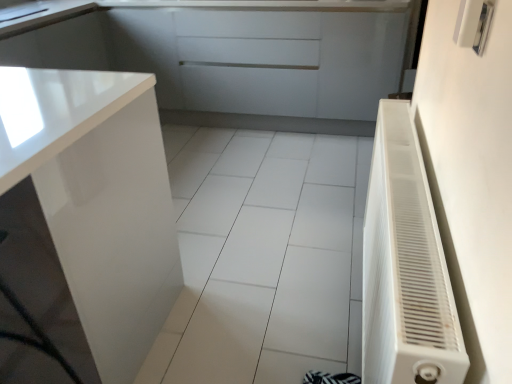
Question: Is metallic silver switch at upper right positioned before glossy white cabinet at upper left, marked as the 2th cabinetry in a bottom-to-top arrangement?

Choices:
 (A) no
 (B) yes

Answer: (B)

Question: From the image's perspective, is metallic silver switch at upper right under glossy white cabinet at upper left, marked as the 2th cabinetry in a bottom-to-top arrangement?

Choices:
 (A) yes
 (B) no

Answer: (A)

Question: From a real-world perspective, is metallic silver switch at upper right located higher than glossy white cabinet at upper left, marked as the 2th cabinetry in a bottom-to-top arrangement?

Choices:
 (A) yes
 (B) no

Answer: (A)

Question: Is metallic silver switch at upper right far from glossy white cabinet at upper left, placed as the 2th cabinetry when sorted from front to back?

Choices:
 (A) yes
 (B) no

Answer: (A)

Question: Is metallic silver switch at upper right oriented away from glossy white cabinet at upper left, the 1th cabinetry viewed from the top?

Choices:
 (A) no
 (B) yes

Answer: (A)

Question: Relative to white glossy tile at center, is metallic silver switch at upper right in front or behind?

Choices:
 (A) front
 (B) behind

Answer: (A)

Question: Based on their positions, is metallic silver switch at upper right located to the left or right of white glossy tile at center?

Choices:
 (A) right
 (B) left

Answer: (A)

Question: In terms of width, does metallic silver switch at upper right look wider or thinner when compared to white glossy tile at center?

Choices:
 (A) thin
 (B) wide

Answer: (A)

Question: Considering the positions of point (468, 39) and point (321, 241), is point (468, 39) closer or farther from the camera than point (321, 241)?

Choices:
 (A) closer
 (B) farther

Answer: (A)

Question: Looking at the image, does white plastic radiator at right seem bigger or smaller compared to white glossy tile at center?

Choices:
 (A) big
 (B) small

Answer: (B)

Question: Considering the positions of point (372, 278) and point (183, 193), is point (372, 278) closer or farther from the camera than point (183, 193)?

Choices:
 (A) farther
 (B) closer

Answer: (B)

Question: Considering the relative positions of white plastic radiator at right and white glossy tile at center in the image provided, is white plastic radiator at right to the left or to the right of white glossy tile at center?

Choices:
 (A) right
 (B) left

Answer: (A)

Question: From a real-world perspective, is white plastic radiator at right above or below white glossy tile at center?

Choices:
 (A) above
 (B) below

Answer: (A)

Question: In terms of width, does glossy white cabinet at upper left, marked as the first cabinetry in a back-to-front arrangement, look wider or thinner when compared to metallic silver switch at upper right?

Choices:
 (A) thin
 (B) wide

Answer: (B)

Question: Do you think glossy white cabinet at upper left, placed as the 2th cabinetry when sorted from front to back, is within metallic silver switch at upper right, or outside of it?

Choices:
 (A) inside
 (B) outside

Answer: (B)